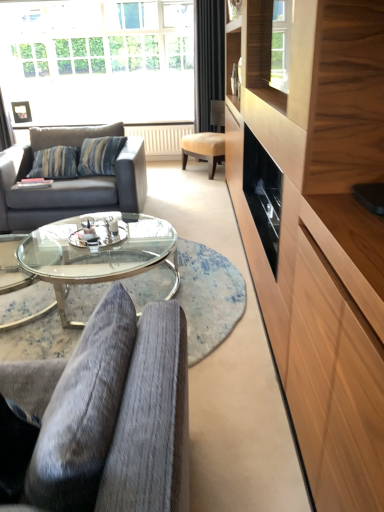
Question: Should I look upward or downward to see beige leather chair at center, the second chair when ordered from bottom to top?

Choices:
 (A) up
 (B) down

Answer: (A)

Question: Considering the relative sizes of beige leather chair at center, the second chair when ordered from bottom to top, and gray fabric couch at left in the image provided, is beige leather chair at center, the second chair when ordered from bottom to top, shorter than gray fabric couch at left?

Choices:
 (A) no
 (B) yes

Answer: (A)

Question: From a real-world perspective, is beige leather chair at center, the second chair when ordered from bottom to top, located higher than gray fabric couch at left?

Choices:
 (A) yes
 (B) no

Answer: (A)

Question: From a real-world perspective, is beige leather chair at center, the 2th chair from the front, beneath gray fabric couch at left?

Choices:
 (A) yes
 (B) no

Answer: (B)

Question: From the image's perspective, is beige leather chair at center, the 1th chair positioned from the top, below gray fabric couch at left?

Choices:
 (A) no
 (B) yes

Answer: (A)

Question: Is beige leather chair at center, the first chair positioned from the back, not near gray fabric couch at left?

Choices:
 (A) yes
 (B) no

Answer: (A)

Question: Is beige leather chair at center, arranged as the first chair when viewed from the right, oriented away from gray fabric couch at left?

Choices:
 (A) no
 (B) yes

Answer: (A)

Question: Is transparent glass coffee table at center not close to beige leather chair at center, the second chair when ordered from bottom to top?

Choices:
 (A) no
 (B) yes

Answer: (B)

Question: Is the position of transparent glass coffee table at center less distant than that of beige leather chair at center, the first chair positioned from the back?

Choices:
 (A) no
 (B) yes

Answer: (B)

Question: Considering the relative sizes of transparent glass coffee table at center and beige leather chair at center, the 1th chair positioned from the top, in the image provided, is transparent glass coffee table at center smaller than beige leather chair at center, the 1th chair positioned from the top,?

Choices:
 (A) no
 (B) yes

Answer: (A)

Question: From a real-world perspective, is transparent glass coffee table at center physically below beige leather chair at center, the 2th chair from the front?

Choices:
 (A) yes
 (B) no

Answer: (A)

Question: Can you confirm if transparent glass coffee table at center is positioned to the left of beige leather chair at center, which is the second chair from left to right?

Choices:
 (A) yes
 (B) no

Answer: (A)

Question: Is transparent glass coffee table at center behind beige leather chair at center, which is the second chair from left to right?

Choices:
 (A) no
 (B) yes

Answer: (A)

Question: Is black velvet curtain at upper center to the left of transparent glass coffee table at center from the viewer's perspective?

Choices:
 (A) yes
 (B) no

Answer: (B)